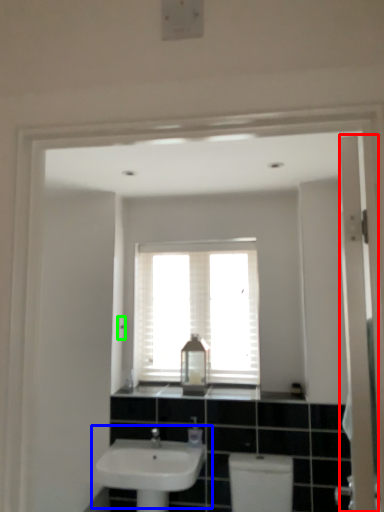
Question: Which object is positioned farthest from screen door (highlighted by a red box)? Select from sink (highlighted by a blue box) and light switch (highlighted by a green box).

Choices:
 (A) sink
 (B) light switch

Answer: (B)